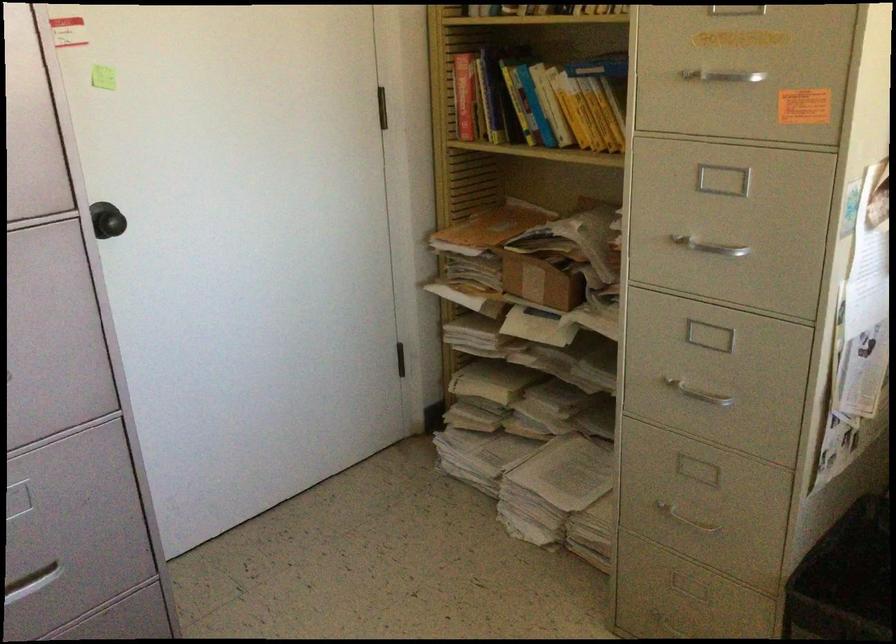
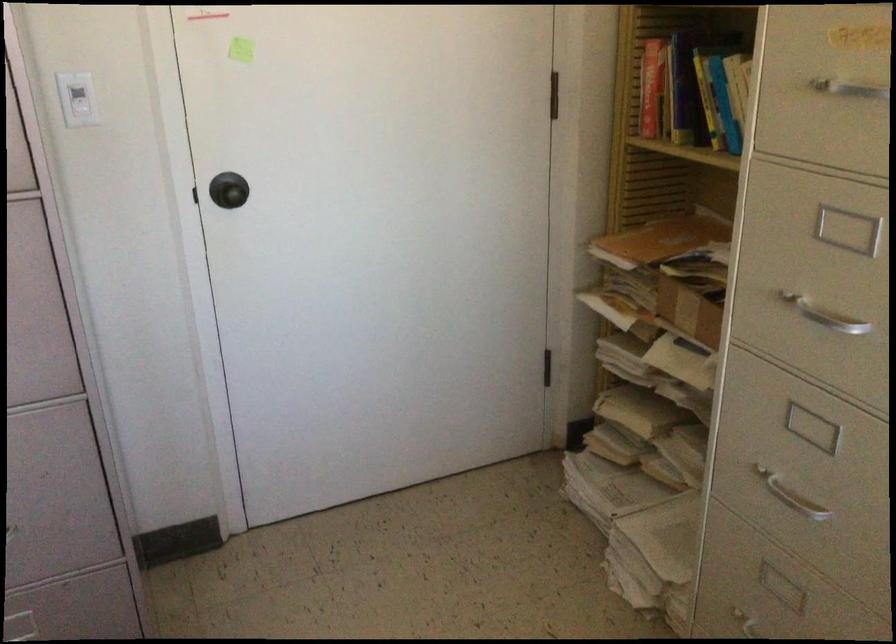
Where in the second image is the point corresponding to the point at 107,218 from the first image?

(228, 190)